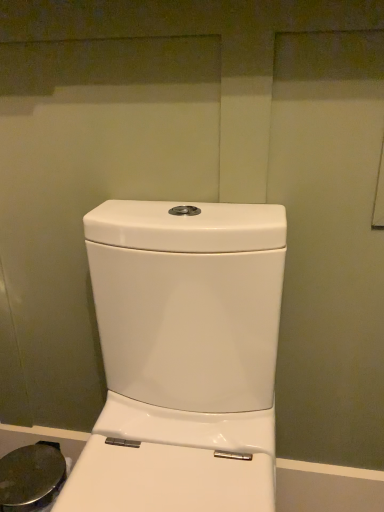
Where is `white glossy toilet at center`? The width and height of the screenshot is (384, 512). white glossy toilet at center is located at coordinates click(x=183, y=357).

What do you see at coordinates (183, 357) in the screenshot? The height and width of the screenshot is (512, 384). I see `white glossy toilet at center` at bounding box center [183, 357].

Image resolution: width=384 pixels, height=512 pixels. I want to click on white glossy toilet at center, so click(183, 357).